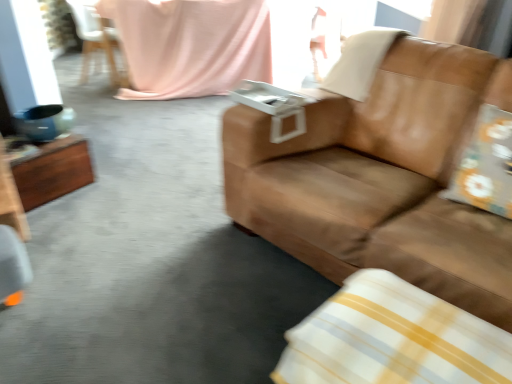
Question: Does pink fabric at upper center come in front of white/yellow striped pillow at lower right, which is counted as the third pillow, starting from the back?

Choices:
 (A) yes
 (B) no

Answer: (B)

Question: From the image's perspective, does pink fabric at upper center appear lower than white/yellow striped pillow at lower right, the 1th pillow positioned from the bottom?

Choices:
 (A) no
 (B) yes

Answer: (A)

Question: Is pink fabric at upper center not within white/yellow striped pillow at lower right, the first pillow viewed from the front?

Choices:
 (A) no
 (B) yes

Answer: (B)

Question: Does pink fabric at upper center have a larger size compared to white/yellow striped pillow at lower right, marked as the 3th pillow in a top-to-bottom arrangement?

Choices:
 (A) yes
 (B) no

Answer: (A)

Question: Is pink fabric at upper center next to white/yellow striped pillow at lower right, the first pillow viewed from the front, and touching it?

Choices:
 (A) yes
 (B) no

Answer: (B)

Question: Is pink fabric at upper center positioned with its back to white/yellow striped pillow at lower right, which is counted as the third pillow, starting from the back?

Choices:
 (A) yes
 (B) no

Answer: (B)

Question: Considering the relative sizes of brown leather couch at center and pink fabric at upper center in the image provided, is brown leather couch at center taller than pink fabric at upper center?

Choices:
 (A) no
 (B) yes

Answer: (B)

Question: Considering the relative positions of brown leather couch at center and pink fabric at upper center in the image provided, is brown leather couch at center to the left of pink fabric at upper center from the viewer's perspective?

Choices:
 (A) no
 (B) yes

Answer: (A)

Question: Is brown leather couch at center turned away from pink fabric at upper center?

Choices:
 (A) yes
 (B) no

Answer: (B)

Question: Does brown leather couch at center have a greater width compared to pink fabric at upper center?

Choices:
 (A) yes
 (B) no

Answer: (A)

Question: From a real-world perspective, is brown leather couch at center beneath pink fabric at upper center?

Choices:
 (A) no
 (B) yes

Answer: (A)

Question: Is brown leather couch at center positioned far away from pink fabric at upper center?

Choices:
 (A) no
 (B) yes

Answer: (B)

Question: Is white plastic chair at upper left further to the viewer compared to white/yellow striped pillow at lower right, marked as the 3th pillow in a top-to-bottom arrangement?

Choices:
 (A) yes
 (B) no

Answer: (A)